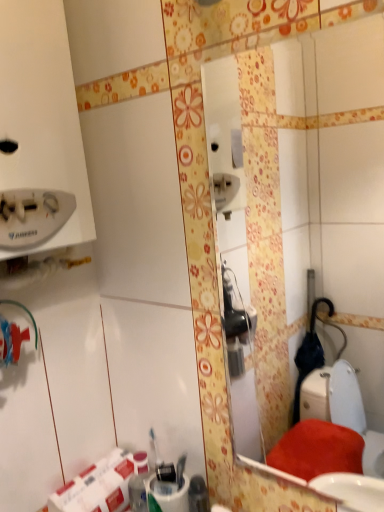
Question: Based on their positions, is white matte toilet paper at lower left located to the left or right of white glossy mirror at center?

Choices:
 (A) right
 (B) left

Answer: (B)

Question: Considering the positions of white matte toilet paper at lower left and white glossy mirror at center in the image, is white matte toilet paper at lower left bigger or smaller than white glossy mirror at center?

Choices:
 (A) big
 (B) small

Answer: (A)

Question: From the image's perspective, relative to white glossy mirror at center, is white matte toilet paper at lower left above or below?

Choices:
 (A) above
 (B) below

Answer: (B)

Question: Considering the relative positions of white glossy mirror at center and white matte toilet paper at lower left in the image provided, is white glossy mirror at center to the left or to the right of white matte toilet paper at lower left?

Choices:
 (A) left
 (B) right

Answer: (B)

Question: From a real-world perspective, relative to white matte toilet paper at lower left, is white glossy mirror at center vertically above or below?

Choices:
 (A) above
 (B) below

Answer: (A)

Question: Is white glossy mirror at center situated inside white matte toilet paper at lower left or outside?

Choices:
 (A) inside
 (B) outside

Answer: (B)

Question: Considering the positions of point (347, 146) and point (79, 474), is point (347, 146) closer or farther from the camera than point (79, 474)?

Choices:
 (A) farther
 (B) closer

Answer: (A)